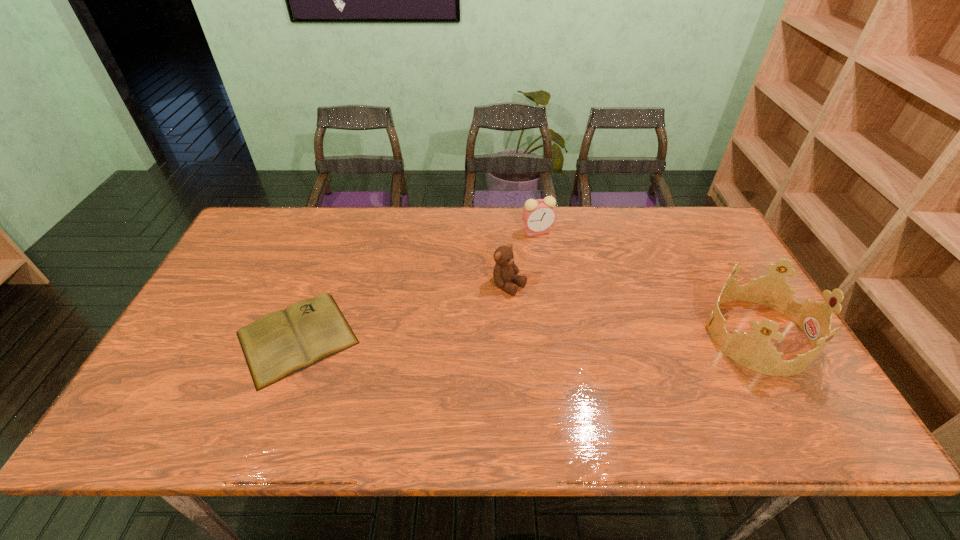
Image resolution: width=960 pixels, height=540 pixels. Find the location of `object that is at the near right corner`. object that is at the near right corner is located at coordinates (754, 351).

At what (x,y) coordinates should I click in order to perform the action: click on free space at the far edge of the desktop. Please return your answer as a coordinate pair (x, y). Looking at the image, I should click on (523, 220).

You are a GUI agent. You are given a task and a screenshot of the screen. Output one action in this format:
    pyautogui.click(x=<x>, y=<y>)
    Task: Click on the vacant space at the near edge of the desktop
    The height and width of the screenshot is (540, 960).
    Given the screenshot: What is the action you would take?
    pyautogui.click(x=618, y=375)

The height and width of the screenshot is (540, 960). I want to click on vacant space at the left edge of the desktop, so click(x=223, y=332).

Locate an element on the screen. blank space at the near left corner is located at coordinates (211, 389).

In the image, there is a desktop. Identify the location of vacant region at the far right corner. click(x=656, y=206).

Where is `free point between the alarm clock and the third object from right to left`? This screenshot has height=540, width=960. free point between the alarm clock and the third object from right to left is located at coordinates (523, 258).

You are a GUI agent. You are given a task and a screenshot of the screen. Output one action in this format:
    pyautogui.click(x=<x>, y=<y>)
    Task: Click on the free space between the book and the tallest object
    This screenshot has width=960, height=540.
    Given the screenshot: What is the action you would take?
    pyautogui.click(x=527, y=336)

The height and width of the screenshot is (540, 960). What are the coordinates of `vacant region between the tiara and the second object from left to right` in the screenshot? It's located at (634, 310).

Identify the location of vacant region between the shortest object and the second object from left to right. (403, 312).